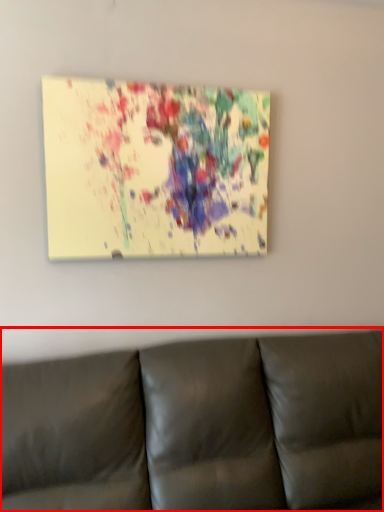
Question: In this image, where is studio couch (annotated by the red box) located relative to picture frame?

Choices:
 (A) right
 (B) left

Answer: (A)